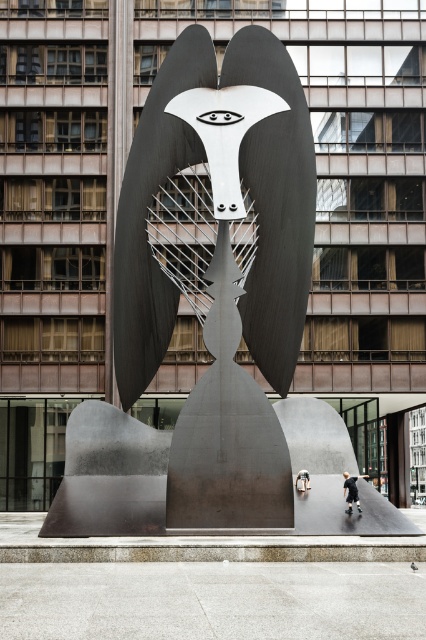
Does polished steel sculpture at center have a larger size compared to metallic silver figure at center?

Yes.

Does polished steel sculpture at center appear on the right side of metallic silver figure at center?

Incorrect, polished steel sculpture at center is not on the right side of metallic silver figure at center.

Identify the location of polished steel sculpture at center. The width and height of the screenshot is (426, 640). (222, 273).

What do you see at coordinates (351, 490) in the screenshot? The height and width of the screenshot is (640, 426). I see `black matte skateboarder at center` at bounding box center [351, 490].

Between point (359, 512) and point (298, 476), which one is positioned in front?

Point (359, 512)

The height and width of the screenshot is (640, 426). Identify the location of black matte skateboarder at center. (351, 490).

The height and width of the screenshot is (640, 426). Find the location of `black matte skateboarder at center`. black matte skateboarder at center is located at coordinates (351, 490).

Image resolution: width=426 pixels, height=640 pixels. Describe the element at coordinates (222, 273) in the screenshot. I see `polished steel sculpture at center` at that location.

Does polished steel sculpture at center have a lesser width compared to black matte skateboarder at center?

No.

What do you see at coordinates (222, 273) in the screenshot?
I see `polished steel sculpture at center` at bounding box center [222, 273].

Image resolution: width=426 pixels, height=640 pixels. I want to click on polished steel sculpture at center, so click(x=222, y=273).